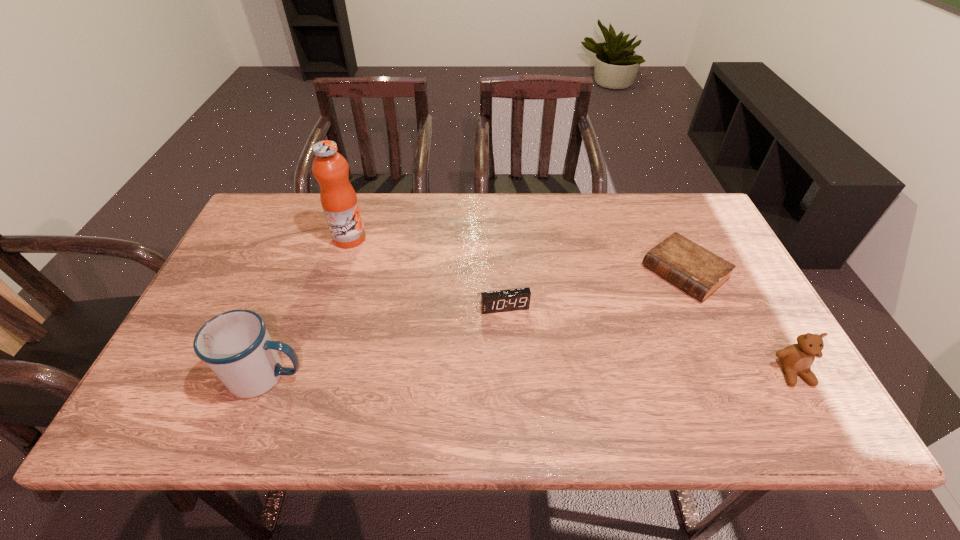
The image size is (960, 540). What are the coordinates of `vacant space that's between the fourth shortest object and the tallest object` in the screenshot? It's located at (308, 307).

This screenshot has height=540, width=960. In order to click on blank region between the diary and the fourth shortest object in this screenshot , I will do `click(476, 325)`.

Where is `free space between the second shortest object and the diary`? The width and height of the screenshot is (960, 540). free space between the second shortest object and the diary is located at coordinates (594, 290).

Where is `free point between the third shortest object and the mug`? This screenshot has width=960, height=540. free point between the third shortest object and the mug is located at coordinates (530, 374).

In order to click on empty space that is in between the teddy bear and the third object from right to left in this screenshot , I will do `click(649, 340)`.

In order to click on unoccupied position between the teddy bear and the shortest object in this screenshot , I will do `click(739, 322)`.

Where is `blank region between the alarm clock and the teddy bear`? The height and width of the screenshot is (540, 960). blank region between the alarm clock and the teddy bear is located at coordinates (649, 340).

Identify the location of unoccupied area between the alarm clock and the third shortest object. (649, 340).

This screenshot has width=960, height=540. What are the coordinates of `unoccupied position between the shortest object and the third tallest object` in the screenshot? It's located at (739, 322).

This screenshot has width=960, height=540. I want to click on free spot between the shortest object and the teddy bear, so (x=739, y=322).